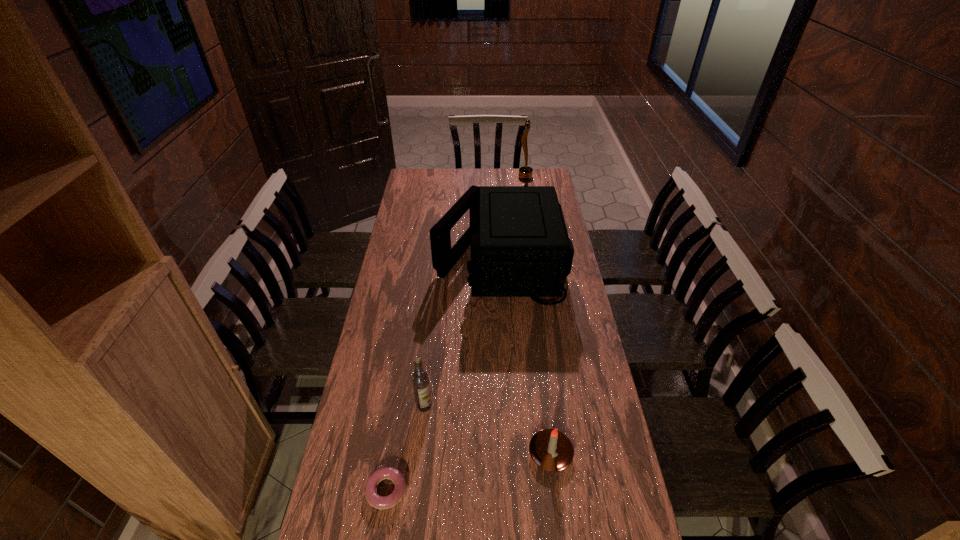
Find the location of a particular element. vacant space situated 0.160m with the door open on the fourth nearest object is located at coordinates (397, 260).

Image resolution: width=960 pixels, height=540 pixels. What are the coordinates of `vacant space situated with the door open on the fourth nearest object` in the screenshot? It's located at [402, 260].

The width and height of the screenshot is (960, 540). Identify the location of vacant space located with the door open on the fourth nearest object. (412, 260).

Identify the location of vacant space located on the label of the vodka. (419, 461).

Where is `vacant space located 0.290m on the back of the fourth tallest object`? vacant space located 0.290m on the back of the fourth tallest object is located at coordinates (539, 354).

This screenshot has width=960, height=540. Find the location of `vacant region located on the right of the doughnut`. vacant region located on the right of the doughnut is located at coordinates (464, 490).

Image resolution: width=960 pixels, height=540 pixels. I want to click on object situated at the far edge, so click(x=525, y=173).

Identify the location of object located in the left edge section of the desktop. The width and height of the screenshot is (960, 540). (379, 502).

The width and height of the screenshot is (960, 540). What are the coordinates of `award that is at the right edge` in the screenshot? It's located at (525, 173).

Where is `microwave oven that is at the right edge`? The height and width of the screenshot is (540, 960). microwave oven that is at the right edge is located at coordinates (520, 247).